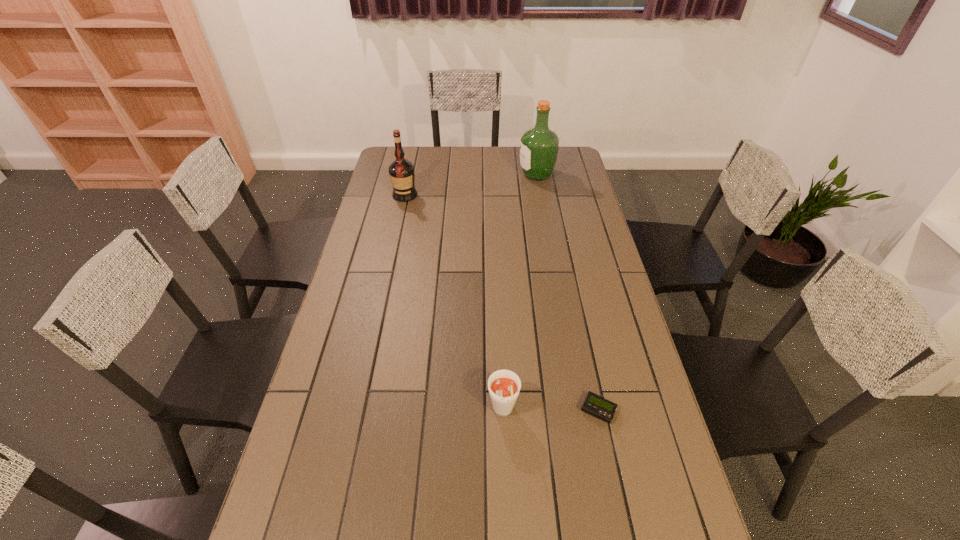
This screenshot has width=960, height=540. I want to click on vacant region located on the surface of the third nearest object, so click(400, 218).

In order to click on vacant space located on the drink side of the root beer in this screenshot , I will do `click(505, 469)`.

The height and width of the screenshot is (540, 960). I want to click on free space located 0.350m on the left of the shortest object, so (445, 410).

Find the location of `object present at the far edge`. object present at the far edge is located at coordinates (539, 146).

I want to click on object present at the left edge, so click(401, 171).

At what (x,y) coordinates should I click in order to perform the action: click on liquor located in the right edge section of the desktop. Please return your answer as a coordinate pair (x, y). Looking at the image, I should click on (539, 146).

Where is `beeper present at the right edge`? Image resolution: width=960 pixels, height=540 pixels. beeper present at the right edge is located at coordinates (595, 405).

Find the location of a particular element. object located at the far right corner is located at coordinates (539, 146).

Locate an element on the screen. Image resolution: width=960 pixels, height=540 pixels. free space at the far edge is located at coordinates (422, 160).

At what (x,y) coordinates should I click in order to perform the action: click on free space at the left edge of the desktop. Please return your answer as a coordinate pair (x, y). The height and width of the screenshot is (540, 960). Looking at the image, I should click on (351, 319).